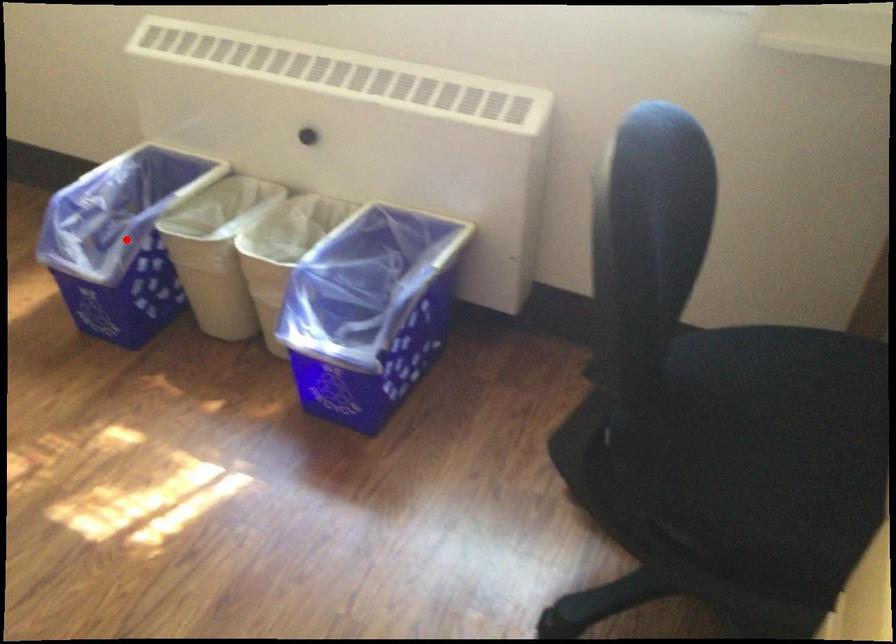
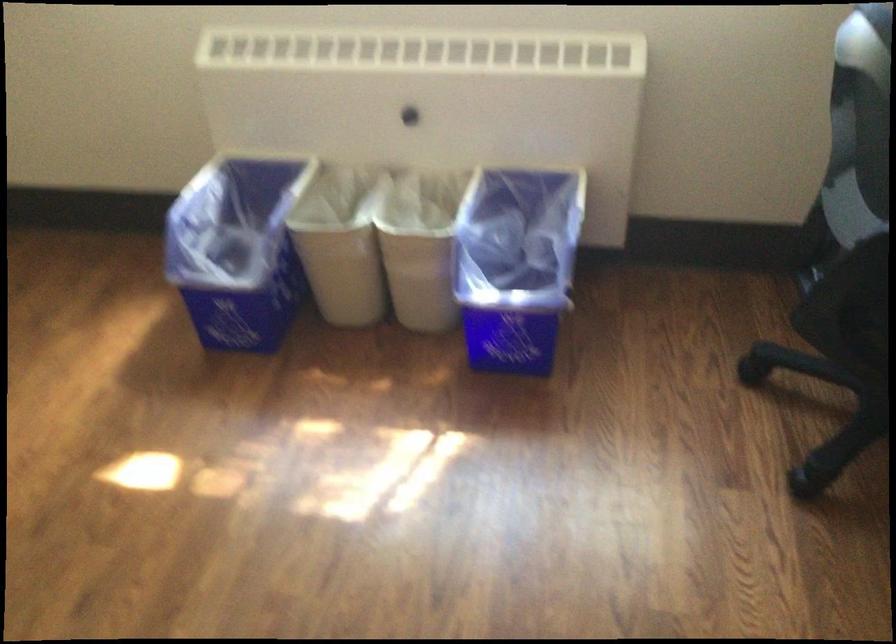
Question: I am providing you with two images of the same scene from different viewpoints. In image1, a red point is highlighted. Considering the same 3D point in image2, which of the following is correct?

Choices:
 (A) It is closer
 (B) It is farther

Answer: (B)